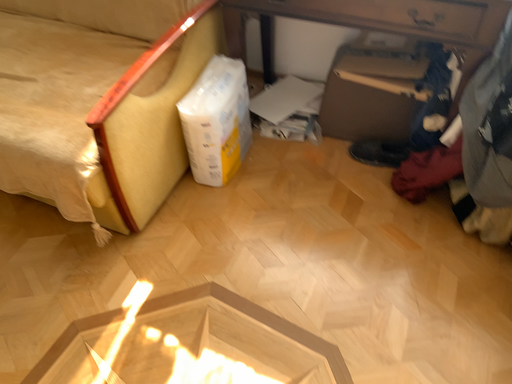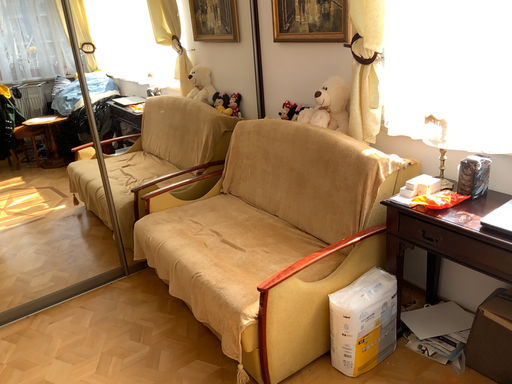
Question: How did the camera likely rotate when shooting the video?

Choices:
 (A) rotated upward
 (B) rotated downward

Answer: (A)